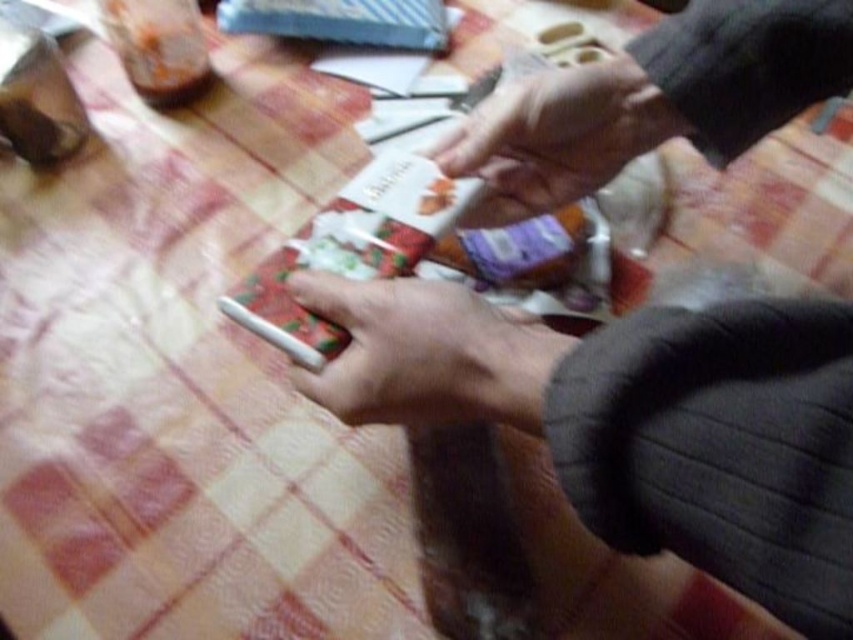
Question: Does white matte cigarette at center have a larger size compared to smooth skin hand at upper center?

Choices:
 (A) no
 (B) yes

Answer: (A)

Question: Which point is farther to the camera?

Choices:
 (A) smooth skin hand at upper center
 (B) white matte cigarette at center

Answer: (A)

Question: Is white matte cigarette at center wider than smooth skin hand at upper center?

Choices:
 (A) no
 (B) yes

Answer: (A)

Question: Can you confirm if white matte cigarette at center is smaller than smooth skin hand at upper center?

Choices:
 (A) yes
 (B) no

Answer: (A)